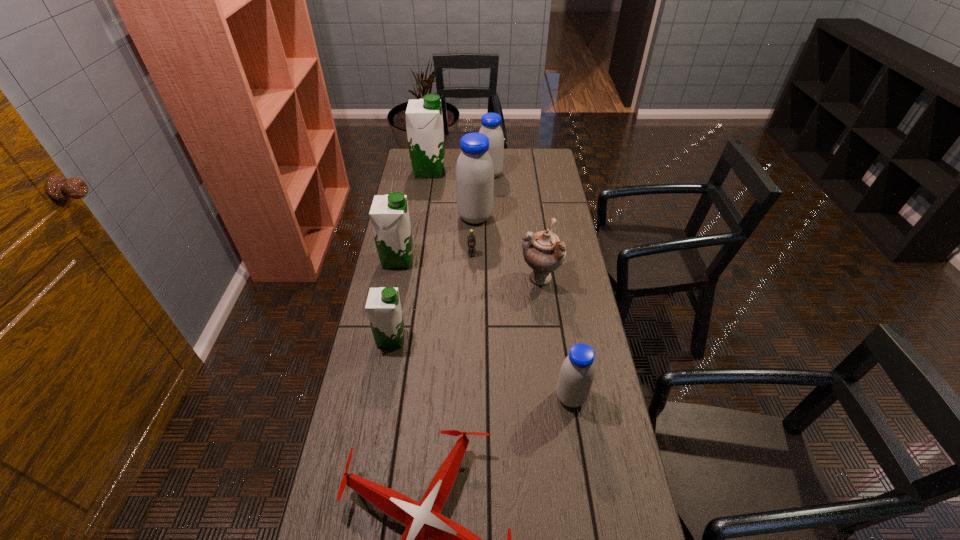
Image resolution: width=960 pixels, height=540 pixels. What are the coordinates of `free location located 0.380m on the front label of the soda` in the screenshot? It's located at (470, 334).

In order to click on urn present at the right edge in this screenshot , I will do `click(543, 252)`.

Where is `soya milk that is at the right edge`? soya milk that is at the right edge is located at coordinates (577, 372).

Where is `object present at the far left corner`? The width and height of the screenshot is (960, 540). object present at the far left corner is located at coordinates (424, 121).

At what (x,y) coordinates should I click in order to perform the action: click on free space at the far edge. Please return your answer as a coordinate pair (x, y). The height and width of the screenshot is (540, 960). Looking at the image, I should click on (448, 167).

This screenshot has width=960, height=540. I want to click on vacant area at the left edge, so click(368, 502).

At what (x,y) coordinates should I click in order to perform the action: click on vacant area at the right edge of the desktop. Please return your answer as a coordinate pair (x, y). The width and height of the screenshot is (960, 540). Looking at the image, I should click on (592, 313).

Identify the location of free space at the far left corner of the desktop. click(x=406, y=171).

Locate an element on the screen. Image resolution: width=960 pixels, height=540 pixels. free space between the third farthest object and the nearest green soya milk is located at coordinates (433, 278).

This screenshot has height=540, width=960. In order to click on vacant space in between the biggest green soya milk and the second smallest green soya milk in this screenshot , I will do `click(414, 215)`.